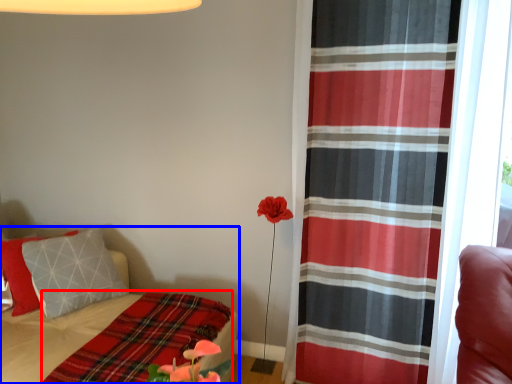
Question: Which point is further to the camera, blanket (highlighted by a red box) or bed (highlighted by a blue box)?

Choices:
 (A) blanket
 (B) bed

Answer: (A)